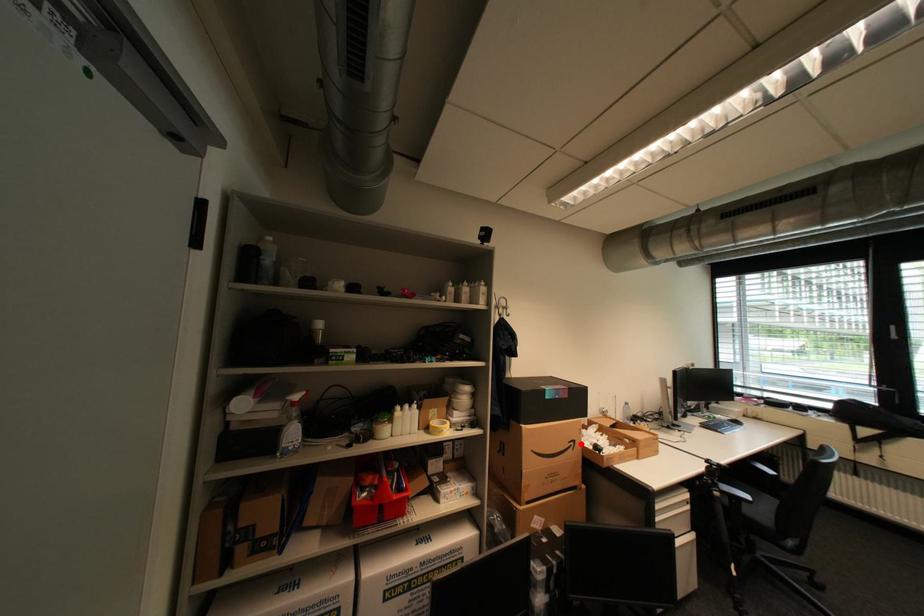
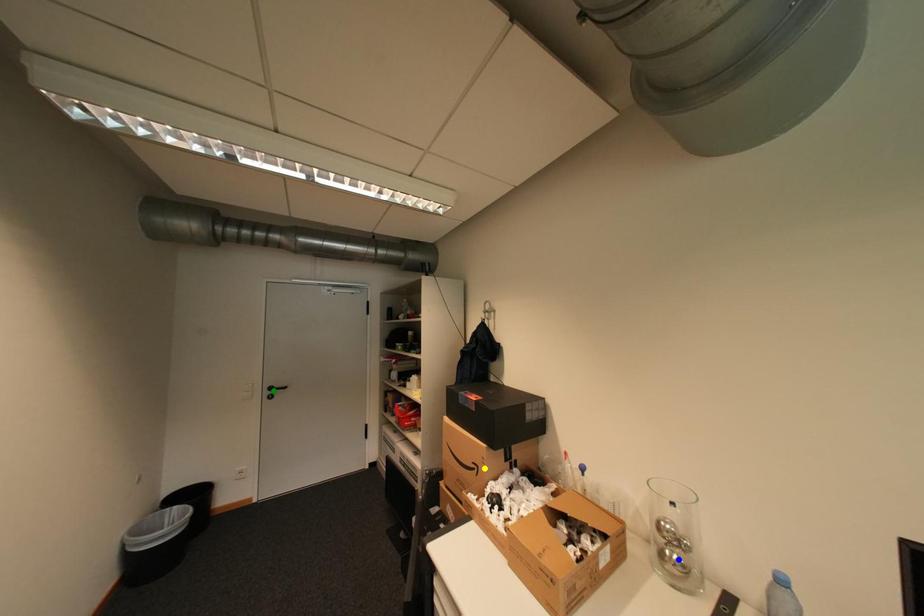
Question: I am providing you with two images of the same scene from different viewpoints. A red point is marked on the first image. You are given multiple points on the second image. Which point in image 2 represents the same 3d spot as the red point in image 1?

Choices:
 (A) blue point
 (B) yellow point
 (C) green point

Answer: (B)